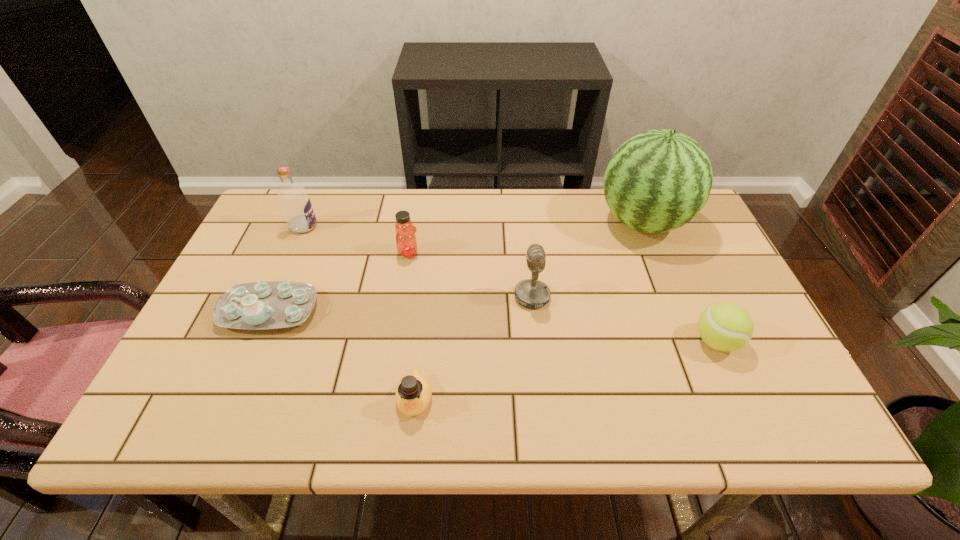
At what (x,y) coordinates should I click in order to perform the action: click on free space located on the front-facing side of the third tallest object. Please return your answer as a coordinate pair (x, y). The height and width of the screenshot is (540, 960). Looking at the image, I should click on (413, 297).

This screenshot has height=540, width=960. I want to click on free space located on the front-facing side of the third tallest object, so point(389,297).

Where is `free space located 0.360m on the front-facing side of the third tallest object`? Image resolution: width=960 pixels, height=540 pixels. free space located 0.360m on the front-facing side of the third tallest object is located at coordinates (373, 297).

This screenshot has width=960, height=540. Find the location of `vacant space located 0.310m on the front label of the honey`. vacant space located 0.310m on the front label of the honey is located at coordinates (530, 253).

Where is `free space located on the right of the tennis ball`? Image resolution: width=960 pixels, height=540 pixels. free space located on the right of the tennis ball is located at coordinates (761, 341).

Locate an element on the screen. The height and width of the screenshot is (540, 960). free space located 0.100m on the right of the chinaware is located at coordinates (357, 310).

Locate an element on the screen. The height and width of the screenshot is (540, 960). watermelon positioned at the far edge is located at coordinates click(x=657, y=181).

Locate an element on the screen. Image resolution: width=960 pixels, height=540 pixels. vodka positioned at the far edge is located at coordinates (295, 203).

Identify the location of object present at the near edge. (413, 394).

Where is `vodka located at the left edge`? The height and width of the screenshot is (540, 960). vodka located at the left edge is located at coordinates (295, 203).